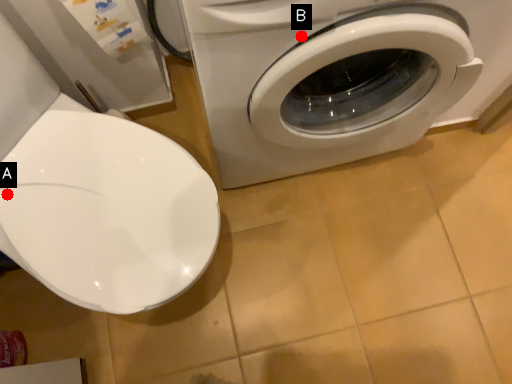
Question: Two points are circled on the image, labeled by A and B beside each circle. Among these points, which one is farthest from the camera?

Choices:
 (A) A is further
 (B) B is further

Answer: (A)